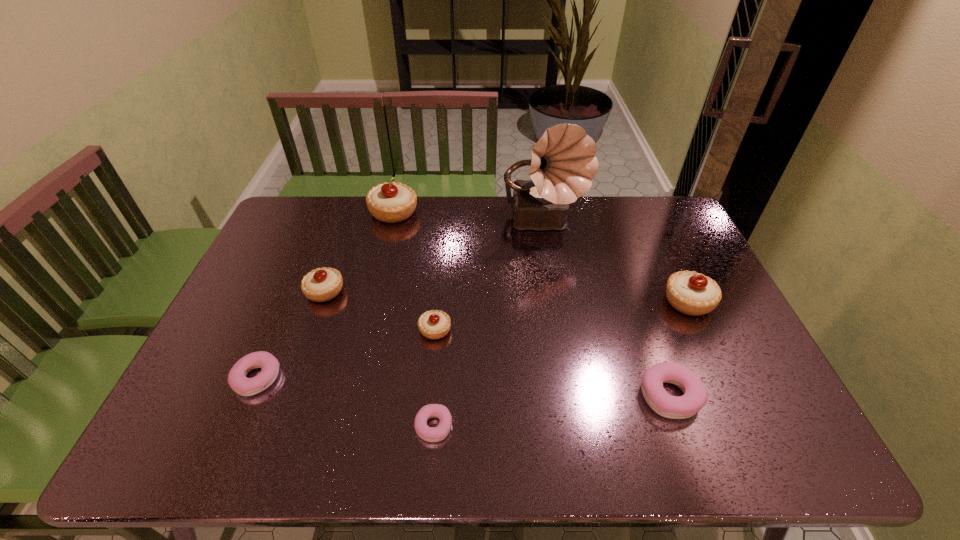
Image resolution: width=960 pixels, height=540 pixels. Find the location of `beige pastry that is the second closest to the rightmost pastry`. beige pastry that is the second closest to the rightmost pastry is located at coordinates (391, 202).

The image size is (960, 540). Identify the location of pink pastry that is the third closest to the record player. (269, 365).

Locate an element on the screen. The width and height of the screenshot is (960, 540). pink pastry that is the closest to the third beige pastry from right to left is located at coordinates (269, 365).

Where is `vacant space that satisfies the following two spatial constraints: 1. on the front side of the second pink pastry from right to left; 2. on the left side of the sixth object from right to left`? The width and height of the screenshot is (960, 540). vacant space that satisfies the following two spatial constraints: 1. on the front side of the second pink pastry from right to left; 2. on the left side of the sixth object from right to left is located at coordinates (343, 426).

The image size is (960, 540). Find the location of `blank area in the image that satisfies the following two spatial constraints: 1. on the back side of the smallest beige pastry; 2. on the right side of the sixth tallest pastry`. blank area in the image that satisfies the following two spatial constraints: 1. on the back side of the smallest beige pastry; 2. on the right side of the sixth tallest pastry is located at coordinates (277, 330).

This screenshot has width=960, height=540. I want to click on free space in the image that satisfies the following two spatial constraints: 1. on the back side of the leftmost pink pastry; 2. on the left side of the fourth tallest object, so click(x=294, y=292).

I want to click on vacant space that satisfies the following two spatial constraints: 1. on the back side of the second biggest beige pastry; 2. on the right side of the fourth shortest object, so click(x=438, y=301).

I want to click on free space that satisfies the following two spatial constraints: 1. on the back side of the leftmost beige pastry; 2. on the right side of the biggest beige pastry, so click(x=352, y=212).

Find the location of a particular element. blank area in the image that satisfies the following two spatial constraints: 1. on the back side of the leftmost pink pastry; 2. on the left side of the third tallest pastry is located at coordinates (294, 292).